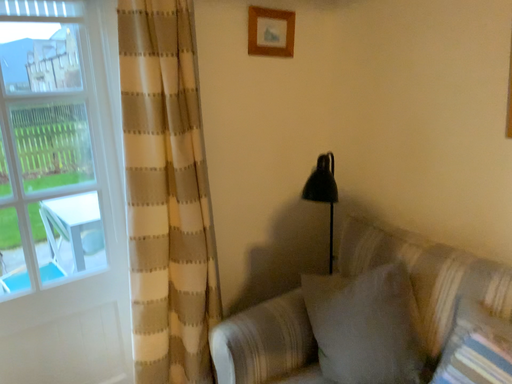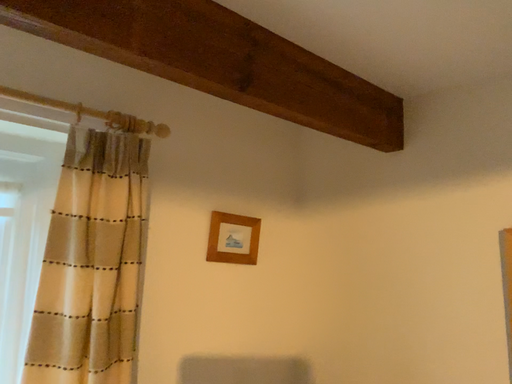
Question: How did the camera likely rotate when shooting the video?

Choices:
 (A) rotated left
 (B) rotated right

Answer: (B)